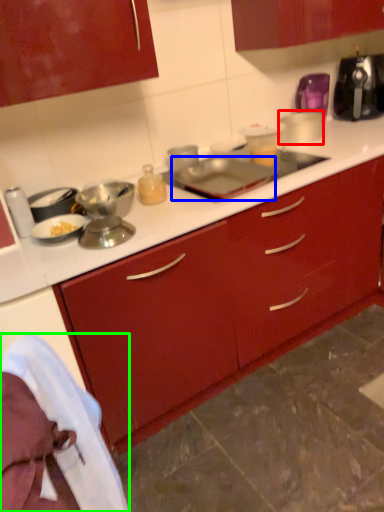
Question: Which object is positioned closest to appliance (highlighted by a red box)? Select from appliance (highlighted by a blue box) and material (highlighted by a green box).

Choices:
 (A) appliance
 (B) material

Answer: (A)